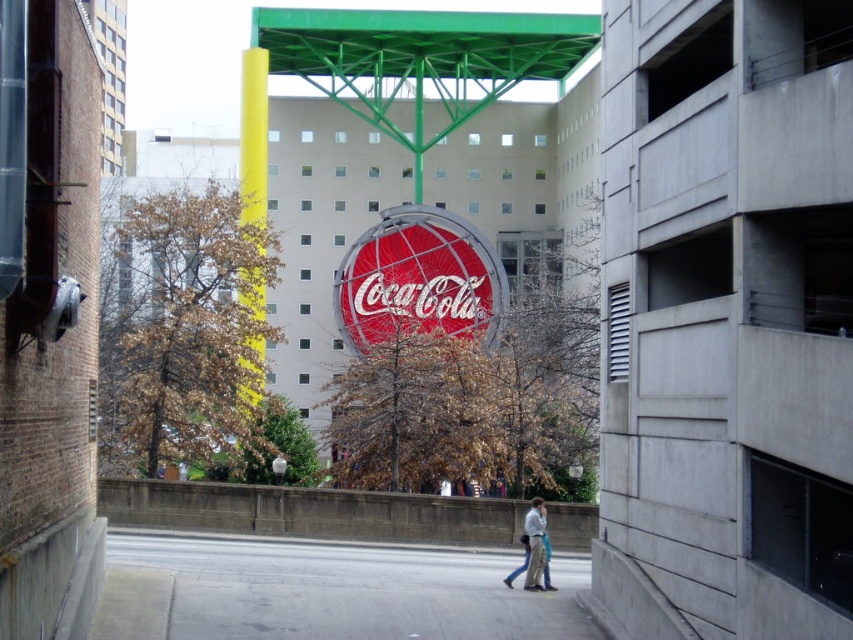
Is gray concrete pavement at center to the right of smooth white lamp post at center from the viewer's perspective?

Correct, you'll find gray concrete pavement at center to the right of smooth white lamp post at center.

Which is in front, point (325, 560) or point (283, 474)?

Positioned in front is point (325, 560).

Does point (521, 634) lie behind point (277, 477)?

No, it is in front of (277, 477).

The width and height of the screenshot is (853, 640). I want to click on gray concrete pavement at center, so click(323, 592).

This screenshot has width=853, height=640. I want to click on light blue jeans at center, so click(x=535, y=544).

Is light blue jeans at center positioned before smooth white lamp post at center?

That is True.

The image size is (853, 640). What are the coordinates of `light blue jeans at center` in the screenshot? It's located at (535, 544).

Does gray concrete pavement at center have a lesser width compared to light blue jeans at center?

No.

Is gray concrete pavement at center wider than light blue jeans at center?

Yes.

Is point (451, 614) behind point (529, 522)?

No.

At what (x,y) coordinates should I click in order to perform the action: click on gray concrete pavement at center. Please return your answer as a coordinate pair (x, y). This screenshot has width=853, height=640. Looking at the image, I should click on (323, 592).